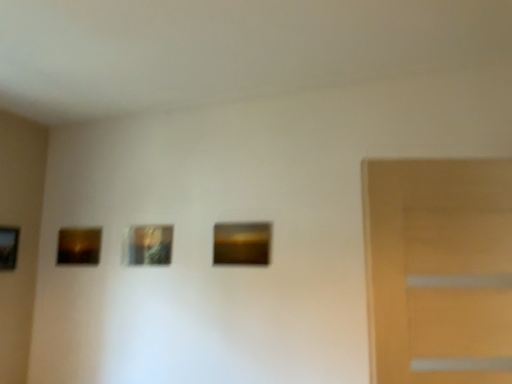
The width and height of the screenshot is (512, 384). What do you see at coordinates (8, 247) in the screenshot? I see `wooden picture frame at left, which is the fourth picture frame in right-to-left order` at bounding box center [8, 247].

Where is `wooden picture frame at left, which is the fourth picture frame in right-to-left order`? wooden picture frame at left, which is the fourth picture frame in right-to-left order is located at coordinates (8, 247).

Image resolution: width=512 pixels, height=384 pixels. I want to click on metallic gold picture frame at center, which is the 2th picture frame in right-to-left order, so click(150, 245).

This screenshot has width=512, height=384. What do you see at coordinates (242, 243) in the screenshot? I see `matte brown picture frame at center, the first picture frame in the right-to-left sequence` at bounding box center [242, 243].

This screenshot has width=512, height=384. What do you see at coordinates (79, 246) in the screenshot? I see `matte brown picture frame at left, the 3th picture frame positioned from the right` at bounding box center [79, 246].

Measure the distance between point (x=94, y=254) and camera.

The distance of point (x=94, y=254) from camera is 7.83 feet.

At what (x,y) coordinates should I click in order to perform the action: click on wooden picture frame at left, which is the fourth picture frame in right-to-left order. Please return your answer as a coordinate pair (x, y). This screenshot has height=384, width=512. Looking at the image, I should click on (8, 247).

Which of these two, matte brown picture frame at center, which is counted as the 4th picture frame, starting from the left, or metallic gold picture frame at center, arranged as the third picture frame when viewed from the left, is thinner?

metallic gold picture frame at center, arranged as the third picture frame when viewed from the left, is thinner.

Can you confirm if matte brown picture frame at center, which is counted as the 4th picture frame, starting from the left, is shorter than metallic gold picture frame at center, which is the 2th picture frame in right-to-left order?

Yes.

In the image, is matte brown picture frame at center, the first picture frame in the right-to-left sequence, on the left side or the right side of metallic gold picture frame at center, which is the 2th picture frame in right-to-left order?

In the image, matte brown picture frame at center, the first picture frame in the right-to-left sequence, appears on the right side of metallic gold picture frame at center, which is the 2th picture frame in right-to-left order.

Which is closer to the camera, (262, 225) or (168, 234)?

Point (262, 225) is positioned closer to the camera compared to point (168, 234).

What's the angular difference between matte brown picture frame at center, the first picture frame in the right-to-left sequence, and matte brown picture frame at left, the 3th picture frame positioned from the right,'s facing directions?

The facing directions of matte brown picture frame at center, the first picture frame in the right-to-left sequence, and matte brown picture frame at left, the 3th picture frame positioned from the right, are 0.0221 degrees apart.

Which is in front, point (254, 252) or point (79, 236)?

Point (254, 252)

Find the location of a particular element. This screenshot has height=384, width=512. picture frame that is the 2nd object to the right of the matte brown picture frame at left, which is the second picture frame in left-to-right order, starting at the anchor is located at coordinates [x=242, y=243].

How different are the orientations of metallic gold picture frame at center, arranged as the third picture frame when viewed from the left, and matte brown picture frame at left, which is the second picture frame in left-to-right order, in degrees?

1.71 degrees.

Can you confirm if metallic gold picture frame at center, which is the 2th picture frame in right-to-left order, is wider than matte brown picture frame at left, the 3th picture frame positioned from the right?

Incorrect, the width of metallic gold picture frame at center, which is the 2th picture frame in right-to-left order, does not surpass that of matte brown picture frame at left, the 3th picture frame positioned from the right.

In the scene shown: Is metallic gold picture frame at center, arranged as the third picture frame when viewed from the left, to the right of matte brown picture frame at left, the 3th picture frame positioned from the right, from the viewer's perspective?

Yes, metallic gold picture frame at center, arranged as the third picture frame when viewed from the left, is to the right of matte brown picture frame at left, the 3th picture frame positioned from the right.

Measure the distance from metallic gold picture frame at center, arranged as the third picture frame when viewed from the left, to matte brown picture frame at left, the 3th picture frame positioned from the right.

A distance of 13.49 inches exists between metallic gold picture frame at center, arranged as the third picture frame when viewed from the left, and matte brown picture frame at left, the 3th picture frame positioned from the right.

Which is in front, point (81, 237) or point (149, 249)?

Positioned in front is point (149, 249).

Could you tell me if matte brown picture frame at left, the 3th picture frame positioned from the right, is facing metallic gold picture frame at center, arranged as the third picture frame when viewed from the left?

No, matte brown picture frame at left, the 3th picture frame positioned from the right, is not turned towards metallic gold picture frame at center, arranged as the third picture frame when viewed from the left.

Between matte brown picture frame at left, the 3th picture frame positioned from the right, and metallic gold picture frame at center, arranged as the third picture frame when viewed from the left, which one has less height?

With less height is metallic gold picture frame at center, arranged as the third picture frame when viewed from the left.

Can you confirm if matte brown picture frame at left, which is the second picture frame in left-to-right order, is wider than metallic gold picture frame at center, which is the 2th picture frame in right-to-left order?

Correct, the width of matte brown picture frame at left, which is the second picture frame in left-to-right order, exceeds that of metallic gold picture frame at center, which is the 2th picture frame in right-to-left order.

Does wooden picture frame at left, which is counted as the first picture frame, starting from the left, touch metallic gold picture frame at center, arranged as the third picture frame when viewed from the left?

No, wooden picture frame at left, which is counted as the first picture frame, starting from the left, is not making contact with metallic gold picture frame at center, arranged as the third picture frame when viewed from the left.

Is wooden picture frame at left, which is counted as the first picture frame, starting from the left, at the left side of metallic gold picture frame at center, which is the 2th picture frame in right-to-left order?

Yes, wooden picture frame at left, which is counted as the first picture frame, starting from the left, is to the left of metallic gold picture frame at center, which is the 2th picture frame in right-to-left order.

Is wooden picture frame at left, which is counted as the first picture frame, starting from the left, in front of or behind metallic gold picture frame at center, arranged as the third picture frame when viewed from the left, in the image?

Visually, wooden picture frame at left, which is counted as the first picture frame, starting from the left, is located in front of metallic gold picture frame at center, arranged as the third picture frame when viewed from the left.

Is point (5, 229) closer or farther from the camera than point (154, 258)?

Point (5, 229) is farther from the camera than point (154, 258).

Looking at their sizes, would you say matte brown picture frame at left, the 3th picture frame positioned from the right, is wider or thinner than matte brown picture frame at center, which is counted as the 4th picture frame, starting from the left?

In the image, matte brown picture frame at left, the 3th picture frame positioned from the right, appears to be more narrow than matte brown picture frame at center, which is counted as the 4th picture frame, starting from the left.

Which object is positioned more to the left, matte brown picture frame at left, the 3th picture frame positioned from the right, or matte brown picture frame at center, which is counted as the 4th picture frame, starting from the left?

From the viewer's perspective, matte brown picture frame at left, the 3th picture frame positioned from the right, appears more on the left side.

From the picture: Is matte brown picture frame at left, the 3th picture frame positioned from the right, located outside matte brown picture frame at center, the first picture frame in the right-to-left sequence?

Indeed, matte brown picture frame at left, the 3th picture frame positioned from the right, is completely outside matte brown picture frame at center, the first picture frame in the right-to-left sequence.

From the picture: Is matte brown picture frame at left, which is the second picture frame in left-to-right order, not close to matte brown picture frame at center, the first picture frame in the right-to-left sequence?

No, matte brown picture frame at left, which is the second picture frame in left-to-right order, is not far from matte brown picture frame at center, the first picture frame in the right-to-left sequence.

Is point (15, 237) closer to viewer compared to point (223, 237)?

No, it is not.

In the scene shown: From the image's perspective, which is below, wooden picture frame at left, which is the fourth picture frame in right-to-left order, or matte brown picture frame at center, which is counted as the 4th picture frame, starting from the left?

wooden picture frame at left, which is the fourth picture frame in right-to-left order, is shown below in the image.

Can you confirm if wooden picture frame at left, which is the fourth picture frame in right-to-left order, is taller than matte brown picture frame at center, the first picture frame in the right-to-left sequence?

Indeed, wooden picture frame at left, which is the fourth picture frame in right-to-left order, has a greater height compared to matte brown picture frame at center, the first picture frame in the right-to-left sequence.

Identify the location of picture frame lying on the right of metallic gold picture frame at center, which is the 2th picture frame in right-to-left order. Image resolution: width=512 pixels, height=384 pixels. (242, 243).

Identify the location of the 1st picture frame directly above the matte brown picture frame at left, which is the second picture frame in left-to-right order (from a real-world perspective). Image resolution: width=512 pixels, height=384 pixels. (242, 243).

Considering their positions, is matte brown picture frame at left, the 3th picture frame positioned from the right, positioned further to matte brown picture frame at center, which is counted as the 4th picture frame, starting from the left, than wooden picture frame at left, which is the fourth picture frame in right-to-left order?

Among the two, wooden picture frame at left, which is the fourth picture frame in right-to-left order, is located further to matte brown picture frame at center, which is counted as the 4th picture frame, starting from the left.

Looking at the image, which one is located closer to metallic gold picture frame at center, which is the 2th picture frame in right-to-left order, matte brown picture frame at left, the 3th picture frame positioned from the right, or wooden picture frame at left, which is the fourth picture frame in right-to-left order?

matte brown picture frame at left, the 3th picture frame positioned from the right, lies closer to metallic gold picture frame at center, which is the 2th picture frame in right-to-left order, than the other object.

Estimate the real-world distances between objects in this image. Which object is closer to wooden picture frame at left, which is counted as the first picture frame, starting from the left, matte brown picture frame at left, which is the second picture frame in left-to-right order, or metallic gold picture frame at center, arranged as the third picture frame when viewed from the left?

matte brown picture frame at left, which is the second picture frame in left-to-right order, is positioned closer to the anchor wooden picture frame at left, which is counted as the first picture frame, starting from the left.

From the picture: Looking at the image, which one is located further to matte brown picture frame at center, the first picture frame in the right-to-left sequence, metallic gold picture frame at center, arranged as the third picture frame when viewed from the left, or matte brown picture frame at left, the 3th picture frame positioned from the right?

matte brown picture frame at left, the 3th picture frame positioned from the right, is positioned further to the anchor matte brown picture frame at center, the first picture frame in the right-to-left sequence.

From the picture: Looking at the image, which one is located further to metallic gold picture frame at center, which is the 2th picture frame in right-to-left order, matte brown picture frame at center, the first picture frame in the right-to-left sequence, or matte brown picture frame at left, which is the second picture frame in left-to-right order?

Among the two, matte brown picture frame at center, the first picture frame in the right-to-left sequence, is located further to metallic gold picture frame at center, which is the 2th picture frame in right-to-left order.

Estimate the real-world distances between objects in this image. Which object is closer to matte brown picture frame at left, which is the second picture frame in left-to-right order, metallic gold picture frame at center, arranged as the third picture frame when viewed from the left, or matte brown picture frame at center, which is counted as the 4th picture frame, starting from the left?

Based on the image, metallic gold picture frame at center, arranged as the third picture frame when viewed from the left, appears to be nearer to matte brown picture frame at left, which is the second picture frame in left-to-right order.

Which object lies nearer to the anchor point wooden picture frame at left, which is counted as the first picture frame, starting from the left, matte brown picture frame at left, the 3th picture frame positioned from the right, or matte brown picture frame at center, which is counted as the 4th picture frame, starting from the left?

Among the two, matte brown picture frame at left, the 3th picture frame positioned from the right, is located nearer to wooden picture frame at left, which is counted as the first picture frame, starting from the left.

Looking at the image, which one is located closer to matte brown picture frame at center, the first picture frame in the right-to-left sequence, metallic gold picture frame at center, which is the 2th picture frame in right-to-left order, or wooden picture frame at left, which is counted as the first picture frame, starting from the left?

metallic gold picture frame at center, which is the 2th picture frame in right-to-left order.

Where is `picture frame between wooden picture frame at left, which is counted as the first picture frame, starting from the left, and metallic gold picture frame at center, which is the 2th picture frame in right-to-left order`? The image size is (512, 384). picture frame between wooden picture frame at left, which is counted as the first picture frame, starting from the left, and metallic gold picture frame at center, which is the 2th picture frame in right-to-left order is located at coordinates (79, 246).

What are the coordinates of `picture frame between matte brown picture frame at left, which is the second picture frame in left-to-right order, and matte brown picture frame at center, which is counted as the 4th picture frame, starting from the left, in the horizontal direction` in the screenshot? It's located at (150, 245).